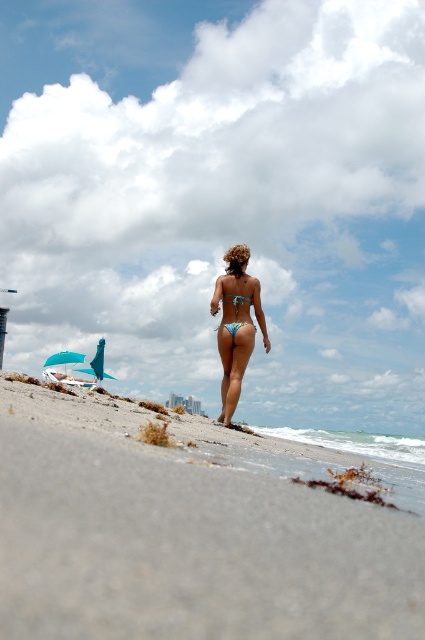
Is point (223, 282) farther from viewer compared to point (235, 307)?

Yes.

Between blue bikini at center and blue matte bikini top at center, which one has more height?

With more height is blue bikini at center.

Is point (226, 305) positioned after point (224, 292)?

No, it is not.

Find the location of a particular element. The width and height of the screenshot is (425, 640). blue bikini at center is located at coordinates (235, 324).

Does gray sand at lower center appear on the right side of blue glossy bikini at center?

Yes, gray sand at lower center is to the right of blue glossy bikini at center.

This screenshot has width=425, height=640. I want to click on gray sand at lower center, so click(x=189, y=532).

Where is `gray sand at lower center`? gray sand at lower center is located at coordinates (189, 532).

Can you confirm if blue bikini at center is wider than blue glossy bikini at center?

Correct, the width of blue bikini at center exceeds that of blue glossy bikini at center.

What do you see at coordinates (235, 324) in the screenshot? The height and width of the screenshot is (640, 425). I see `blue bikini at center` at bounding box center [235, 324].

Is point (261, 310) farther from viewer compared to point (227, 326)?

Yes, point (261, 310) is farther from viewer.

At what (x,y) coordinates should I click in order to perform the action: click on blue bikini at center. Please return your answer as a coordinate pair (x, y). Looking at the image, I should click on (235, 324).